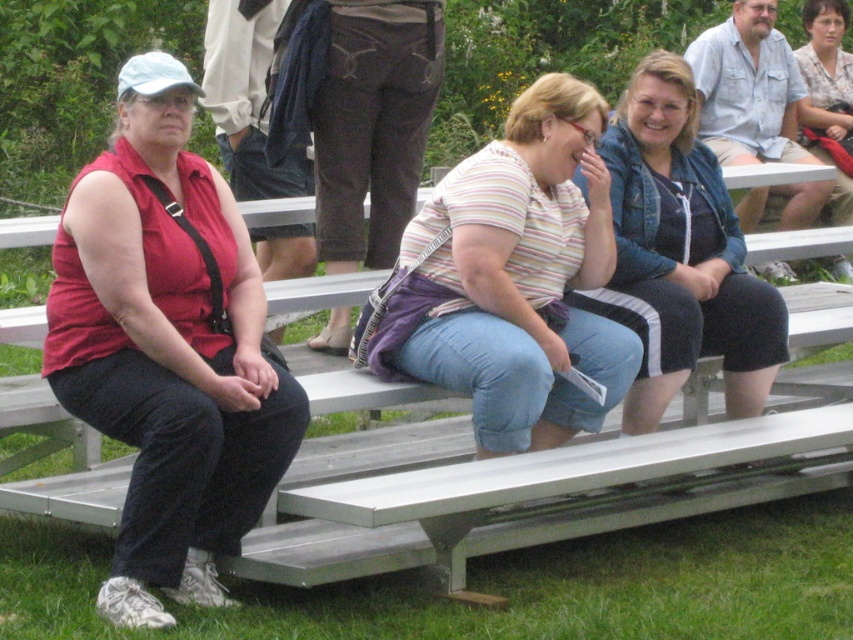
Question: Which point appears farthest from the camera in this image?

Choices:
 (A) (119, 134)
 (B) (704, 211)
 (C) (553, 531)
 (D) (485, 266)

Answer: (B)

Question: From the image, what is the correct spatial relationship of striped cotton shirt at center in relation to striped fabric shirt at center?

Choices:
 (A) right
 (B) left

Answer: (B)

Question: Is striped cotton shirt at center bigger than denim jacket at center?

Choices:
 (A) yes
 (B) no

Answer: (A)

Question: Is matte red shirt at left to the right of striped cotton shirt at center from the viewer's perspective?

Choices:
 (A) no
 (B) yes

Answer: (A)

Question: Estimate the real-world distances between objects in this image. Which object is closer to the denim jacket at center?

Choices:
 (A) striped fabric shirt at center
 (B) metallic silver bench at center
 (C) striped cotton shirt at center

Answer: (C)

Question: Which of these objects is positioned farthest from the matte red shirt at left?

Choices:
 (A) striped cotton shirt at center
 (B) metallic silver bench at center
 (C) striped fabric shirt at center
 (D) denim jacket at center

Answer: (C)